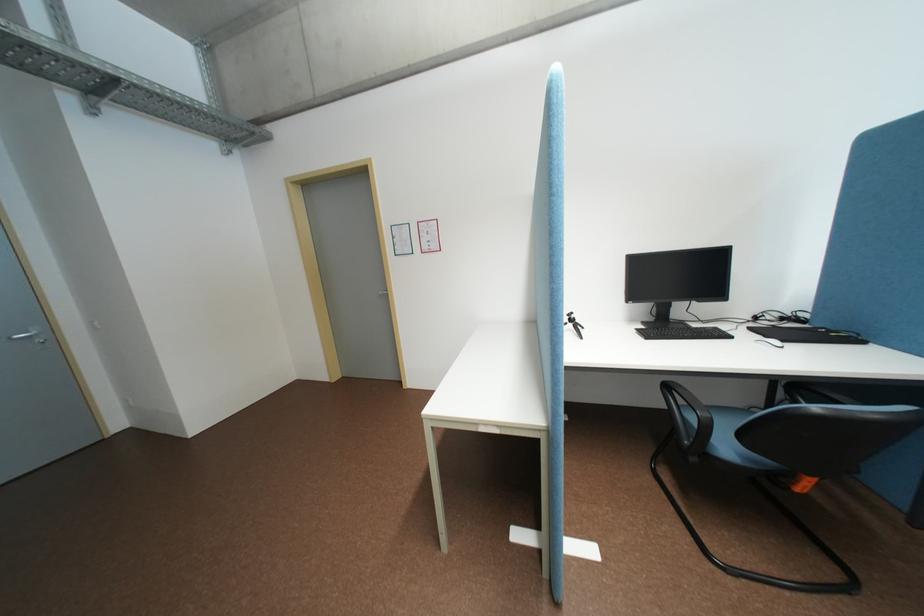
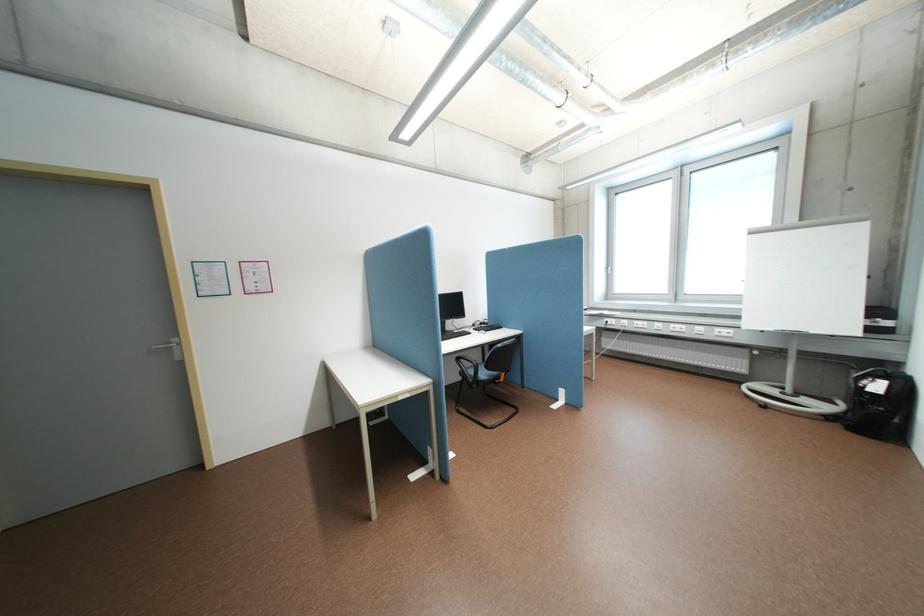
Find the pixel in the second image that matches pixel 738 448 in the first image.

(494, 374)